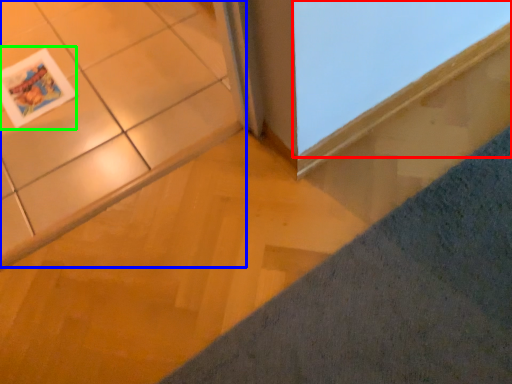
Question: Estimate the real-world distances between objects in this image. Which object is farther from window (highlighted by a red box), ceramic tile (highlighted by a blue box) or magazine (highlighted by a green box)?

Choices:
 (A) ceramic tile
 (B) magazine

Answer: (B)